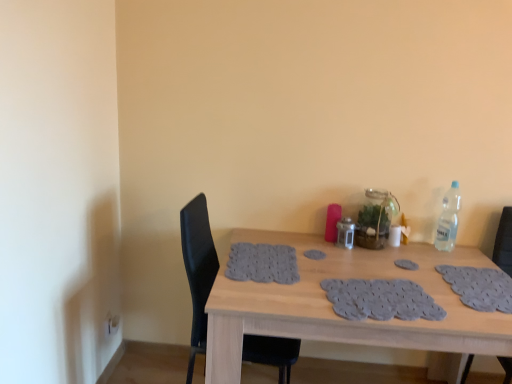
Question: Should I look upward or downward to see black leather chair at left, which is counted as the first chair, starting from the left?

Choices:
 (A) up
 (B) down

Answer: (B)

Question: Does black leather chair at right, which is the first chair in right-to-left order, lie behind black leather chair at left, which is the second chair in right-to-left order?

Choices:
 (A) yes
 (B) no

Answer: (B)

Question: Is black leather chair at right, which is counted as the 2th chair, starting from the left, facing towards black leather chair at left, which is the second chair in right-to-left order?

Choices:
 (A) no
 (B) yes

Answer: (A)

Question: From the image's perspective, is black leather chair at right, which is the first chair in right-to-left order, located beneath black leather chair at left, which is counted as the first chair, starting from the left?

Choices:
 (A) no
 (B) yes

Answer: (B)

Question: Is black leather chair at right, which is the first chair in right-to-left order, far from black leather chair at left, which is the second chair in right-to-left order?

Choices:
 (A) yes
 (B) no

Answer: (A)

Question: Can black leather chair at left, which is counted as the first chair, starting from the left, be found inside black leather chair at right, which is counted as the 2th chair, starting from the left?

Choices:
 (A) yes
 (B) no

Answer: (B)

Question: Can you confirm if black leather chair at right, which is counted as the 2th chair, starting from the left, is bigger than black leather chair at left, which is the second chair in right-to-left order?

Choices:
 (A) no
 (B) yes

Answer: (A)

Question: From the image's perspective, is gray fabric placemat at center, positioned as the first footprint in right-to-left order, located beneath black leather chair at left, which is the second chair in right-to-left order?

Choices:
 (A) no
 (B) yes

Answer: (A)

Question: Is there a large distance between gray fabric placemat at center, positioned as the first footprint in right-to-left order, and black leather chair at left, which is the second chair in right-to-left order?

Choices:
 (A) yes
 (B) no

Answer: (B)

Question: Is gray fabric placemat at center, placed as the first footprint when sorted from bottom to top, shorter than black leather chair at left, which is counted as the first chair, starting from the left?

Choices:
 (A) no
 (B) yes

Answer: (B)

Question: Is gray fabric placemat at center, positioned as the first footprint in right-to-left order, facing towards black leather chair at left, which is the second chair in right-to-left order?

Choices:
 (A) no
 (B) yes

Answer: (A)

Question: Is gray fabric placemat at center, positioned as the first footprint in right-to-left order, taller than black leather chair at left, which is the second chair in right-to-left order?

Choices:
 (A) yes
 (B) no

Answer: (B)

Question: From a real-world perspective, is gray fabric placemat at center, the second footprint viewed from the top, physically above black leather chair at left, which is counted as the first chair, starting from the left?

Choices:
 (A) no
 (B) yes

Answer: (B)

Question: Is wooden table at center surrounding black leather chair at right, which is the first chair in right-to-left order?

Choices:
 (A) no
 (B) yes

Answer: (A)